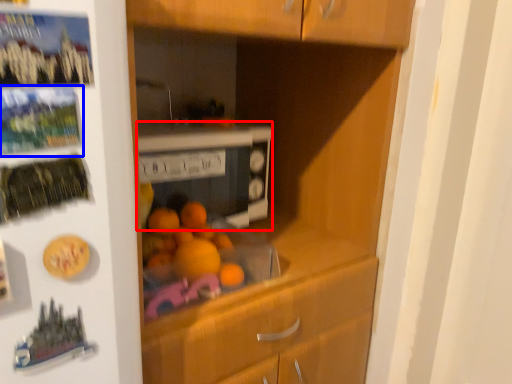
Question: Which point is further to the camera, home appliance (highlighted by a red box) or button (highlighted by a blue box)?

Choices:
 (A) home appliance
 (B) button

Answer: (A)